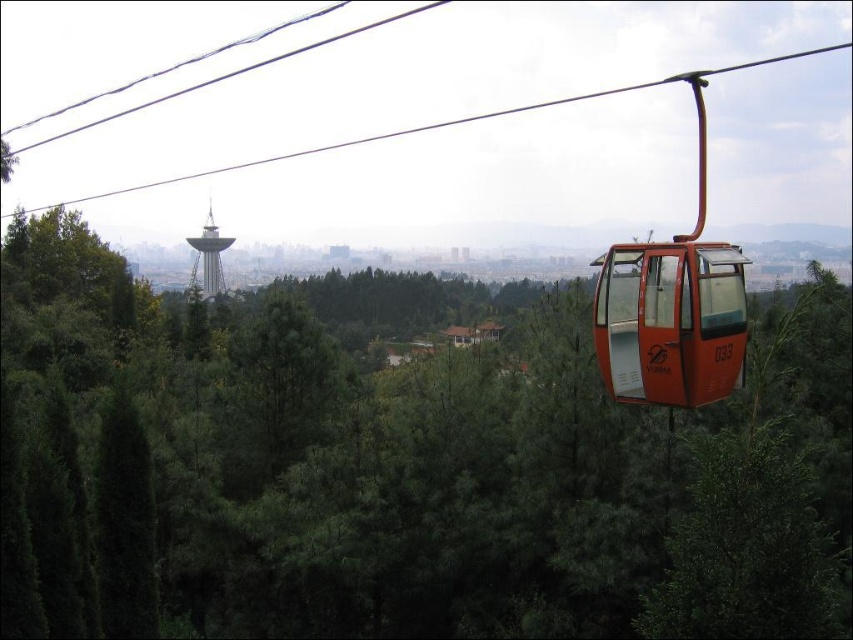
Is orange cable car at upper center positioned in front of metallic silver tower at center?

That is False.

Who is taller, orange cable car at upper center or metallic silver tower at center?

orange cable car at upper center

What do you see at coordinates (434, 128) in the screenshot?
I see `orange cable car at upper center` at bounding box center [434, 128].

This screenshot has height=640, width=853. I want to click on orange cable car at upper center, so click(x=434, y=128).

Can you confirm if orange matte/glossy cable car at right is shorter than metallic silver tower at center?

Indeed, orange matte/glossy cable car at right has a lesser height compared to metallic silver tower at center.

Which is behind, point (602, 317) or point (202, 284)?

Positioned behind is point (202, 284).

Locate an element on the screen. orange matte/glossy cable car at right is located at coordinates (670, 321).

Does orange matte/glossy cable car at right appear on the right side of orange cable car at upper center?

Incorrect, orange matte/glossy cable car at right is not on the right side of orange cable car at upper center.

Can you confirm if orange matte/glossy cable car at right is wider than orange cable car at upper center?

In fact, orange matte/glossy cable car at right might be narrower than orange cable car at upper center.

This screenshot has height=640, width=853. What are the coordinates of `orange matte/glossy cable car at right` in the screenshot? It's located at (670, 321).

This screenshot has width=853, height=640. Find the location of `orange matte/glossy cable car at right`. orange matte/glossy cable car at right is located at coordinates (670, 321).